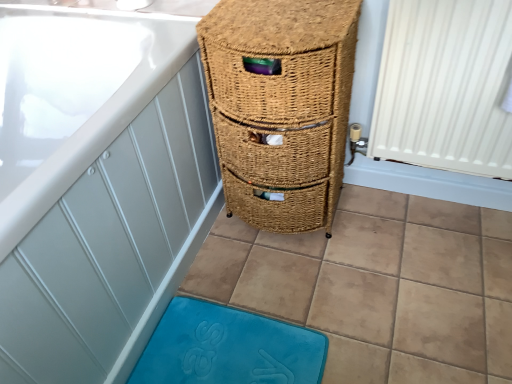
Question: Should I look upward or downward to see white ribbed radiator at right?

Choices:
 (A) up
 (B) down

Answer: (A)

Question: Is woven brown drawer at center not near blue plush bath mat at lower center?

Choices:
 (A) no
 (B) yes

Answer: (A)

Question: Can you confirm if woven brown drawer at center is positioned to the right of blue plush bath mat at lower center?

Choices:
 (A) no
 (B) yes

Answer: (B)

Question: From the image's perspective, is woven brown drawer at center located above blue plush bath mat at lower center?

Choices:
 (A) no
 (B) yes

Answer: (B)

Question: Is woven brown drawer at center facing towards blue plush bath mat at lower center?

Choices:
 (A) no
 (B) yes

Answer: (B)

Question: Is blue plush bath mat at lower center surrounded by woven brown drawer at center?

Choices:
 (A) yes
 (B) no

Answer: (B)

Question: Is woven brown drawer at center behind blue plush bath mat at lower center?

Choices:
 (A) no
 (B) yes

Answer: (A)

Question: From a real-world perspective, is white ribbed radiator at right on woven brown drawer at center?

Choices:
 (A) yes
 (B) no

Answer: (A)

Question: Does white ribbed radiator at right appear on the left side of woven brown drawer at center?

Choices:
 (A) no
 (B) yes

Answer: (A)

Question: Does white ribbed radiator at right have a lesser height compared to woven brown drawer at center?

Choices:
 (A) yes
 (B) no

Answer: (A)

Question: Is white ribbed radiator at right looking in the opposite direction of woven brown drawer at center?

Choices:
 (A) yes
 (B) no

Answer: (B)

Question: Is woven brown drawer at center surrounded by white ribbed radiator at right?

Choices:
 (A) yes
 (B) no

Answer: (B)

Question: Are white ribbed radiator at right and woven brown drawer at center located far from each other?

Choices:
 (A) yes
 (B) no

Answer: (B)

Question: Is woven brown drawer at center at the left side of white ribbed radiator at right?

Choices:
 (A) yes
 (B) no

Answer: (A)